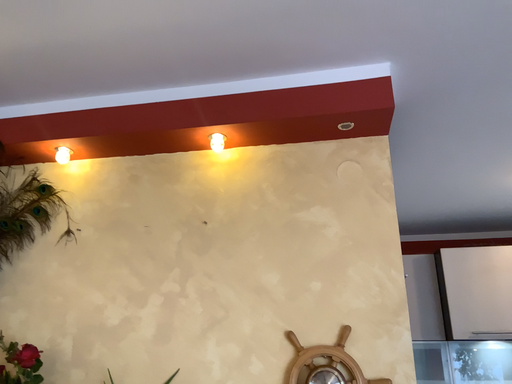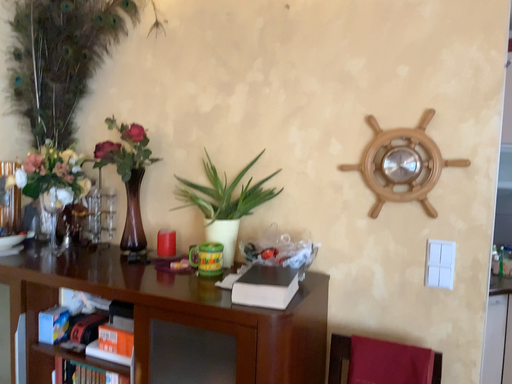
Question: Which way did the camera rotate in the video?

Choices:
 (A) rotated upward
 (B) rotated downward

Answer: (B)